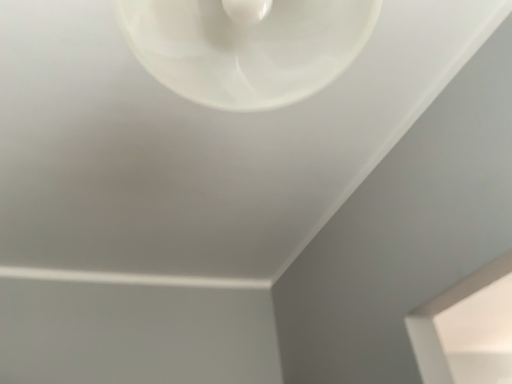
What is the approximate height of white glossy toilet at upper center?

white glossy toilet at upper center is 36.24 centimeters tall.

Where is `white glossy toilet at upper center`? The width and height of the screenshot is (512, 384). white glossy toilet at upper center is located at coordinates 246,46.

The height and width of the screenshot is (384, 512). Describe the element at coordinates (246, 46) in the screenshot. I see `white glossy toilet at upper center` at that location.

You are a GUI agent. You are given a task and a screenshot of the screen. Output one action in this format:
    pyautogui.click(x=<x>, y=<y>)
    Task: Click on the white glossy toilet at upper center
    The height and width of the screenshot is (384, 512).
    Given the screenshot: What is the action you would take?
    pyautogui.click(x=246, y=46)